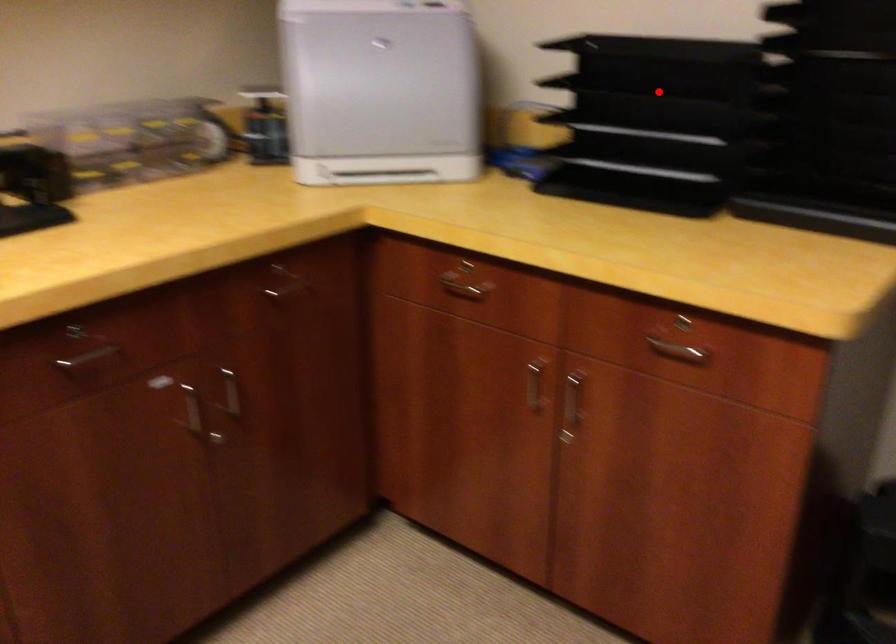
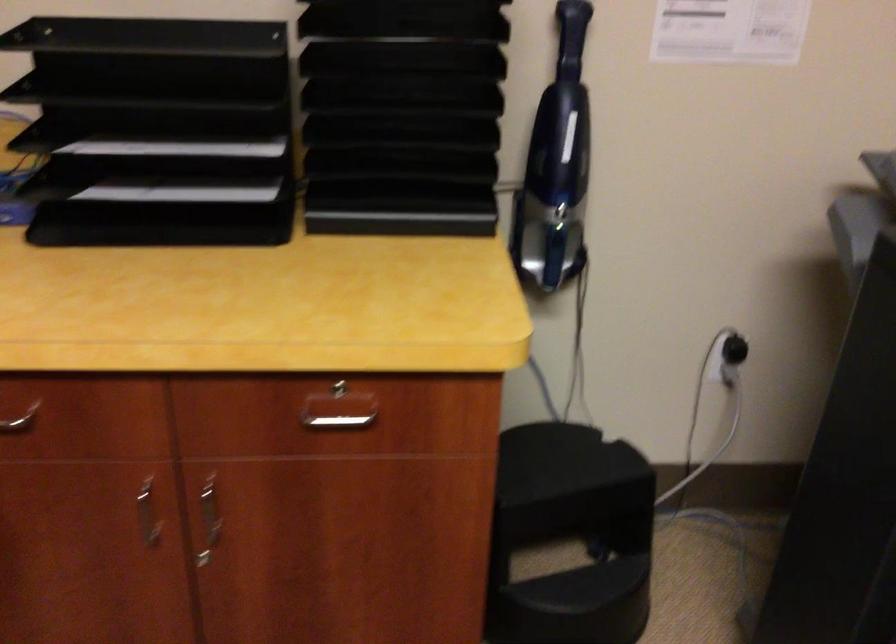
Locate, in the second image, the point that corresponds to the highlighted location in the first image.

(156, 89)